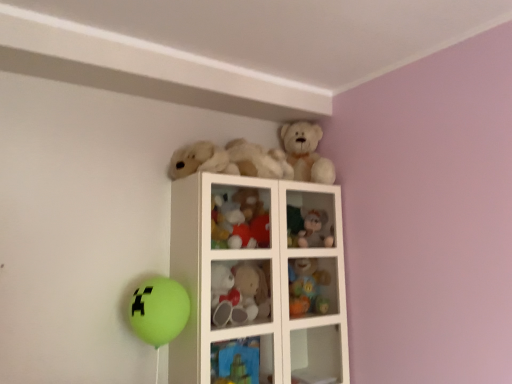
Question: Considering the relative sizes of blue fabric toy at upper center, the second cabinet viewed from the top, and white glass cabinet at upper center in the image provided, is blue fabric toy at upper center, the second cabinet viewed from the top, wider than white glass cabinet at upper center?

Choices:
 (A) no
 (B) yes

Answer: (A)

Question: Can you confirm if blue fabric toy at upper center, the second cabinet viewed from the top, is positioned to the right of white glass cabinet at upper center?

Choices:
 (A) yes
 (B) no

Answer: (B)

Question: Can you confirm if blue fabric toy at upper center, arranged as the 2th cabinet when viewed from the right, is smaller than white glass cabinet at upper center?

Choices:
 (A) no
 (B) yes

Answer: (B)

Question: Is blue fabric toy at upper center, the second cabinet viewed from the top, bigger than white glass cabinet at upper center?

Choices:
 (A) yes
 (B) no

Answer: (B)

Question: From a real-world perspective, is blue fabric toy at upper center, arranged as the 2th cabinet when viewed from the right, beneath white glass cabinet at upper center?

Choices:
 (A) yes
 (B) no

Answer: (A)

Question: Is plush toy at upper right, which is the 5th toy from top to bottom, spatially inside fuzzy fabric teddy bear at upper center, the first cabinet when ordered from right to left, or outside of it?

Choices:
 (A) outside
 (B) inside

Answer: (A)

Question: From the image's perspective, is plush toy at upper right, which is the 5th toy from top to bottom, above or below fuzzy fabric teddy bear at upper center, the second cabinet in the bottom-to-top sequence?

Choices:
 (A) above
 (B) below

Answer: (B)

Question: Considering the relative positions of plush toy at upper right, which is the 5th toy from top to bottom, and fuzzy fabric teddy bear at upper center, the first cabinet when ordered from right to left, in the image provided, is plush toy at upper right, which is the 5th toy from top to bottom, to the left or to the right of fuzzy fabric teddy bear at upper center, the first cabinet when ordered from right to left,?

Choices:
 (A) left
 (B) right

Answer: (A)

Question: Is plush toy at upper right, which is the 5th toy from top to bottom, taller or shorter than fuzzy fabric teddy bear at upper center, the first cabinet when ordered from back to front?

Choices:
 (A) short
 (B) tall

Answer: (B)

Question: Considering the positions of plush toy at upper right, marked as the 1th toy in a bottom-to-top arrangement, and blue fabric toy at upper center, the second cabinet viewed from the top, in the image, is plush toy at upper right, marked as the 1th toy in a bottom-to-top arrangement, wider or thinner than blue fabric toy at upper center, the second cabinet viewed from the top,?

Choices:
 (A) wide
 (B) thin

Answer: (A)

Question: Is plush toy at upper right, marked as the 1th toy in a bottom-to-top arrangement, bigger or smaller than blue fabric toy at upper center, the second cabinet viewed from the top?

Choices:
 (A) small
 (B) big

Answer: (B)

Question: Is plush toy at upper right, which is the 5th toy from top to bottom, taller or shorter than blue fabric toy at upper center, the second cabinet viewed from the top?

Choices:
 (A) tall
 (B) short

Answer: (A)

Question: From a real-world perspective, is plush toy at upper right, marked as the 1th toy in a bottom-to-top arrangement, positioned above or below blue fabric toy at upper center, the second cabinet positioned from the back?

Choices:
 (A) below
 (B) above

Answer: (B)

Question: Considering the positions of point (307, 231) and point (308, 225), is point (307, 231) closer or farther from the camera than point (308, 225)?

Choices:
 (A) closer
 (B) farther

Answer: (A)

Question: From the image's perspective, is white glass cabinet at upper center located above or below fuzzy fabric teddy bear at upper center, the first cabinet when ordered from back to front?

Choices:
 (A) above
 (B) below

Answer: (B)